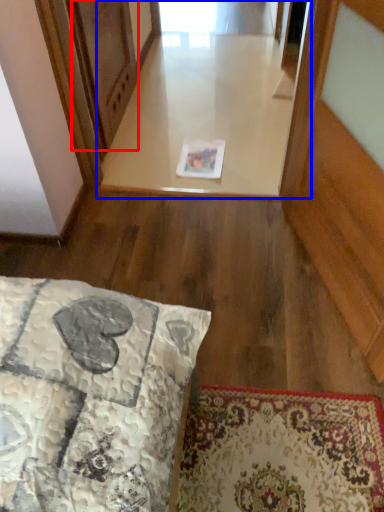
Question: Among these objects, which one is nearest to the camera, screen door (highlighted by a red box) or window (highlighted by a blue box)?

Choices:
 (A) screen door
 (B) window

Answer: (A)